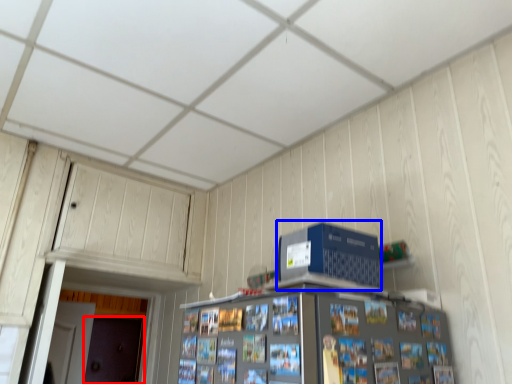
Question: Which object is closer to the camera taking this photo, door (highlighted by a red box) or computer (highlighted by a blue box)?

Choices:
 (A) door
 (B) computer

Answer: (B)